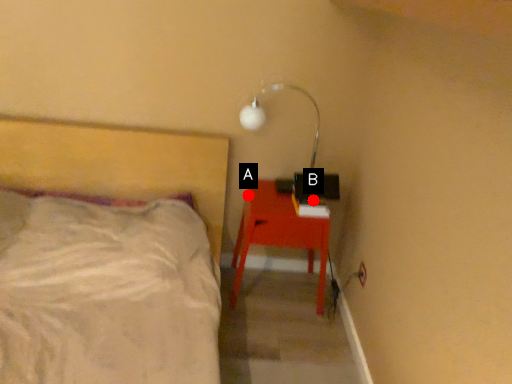
Question: Two points are circled on the image, labeled by A and B beside each circle. Which point is closer to the camera?

Choices:
 (A) A is closer
 (B) B is closer

Answer: (B)